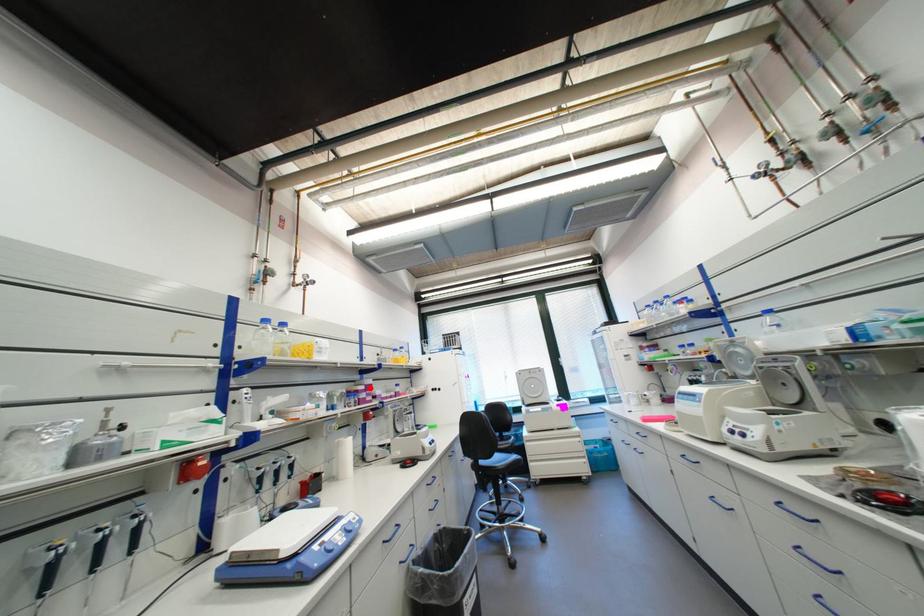
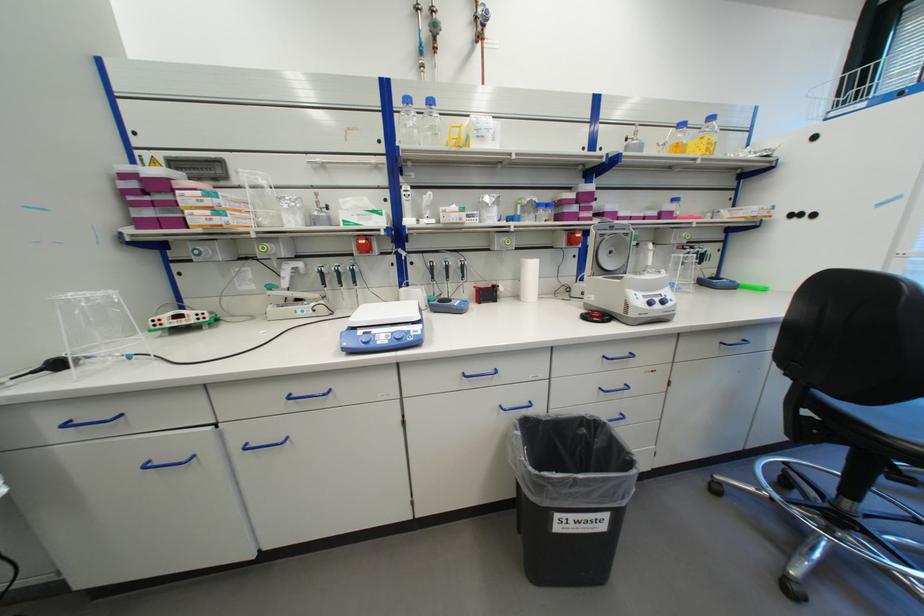
Question: I am providing you with two images of the same scene from different viewpoints. A red point is marked on the first image. At the location where the point appears in image 1, is it still visible in image 2?

Choices:
 (A) Yes
 (B) No

Answer: (A)